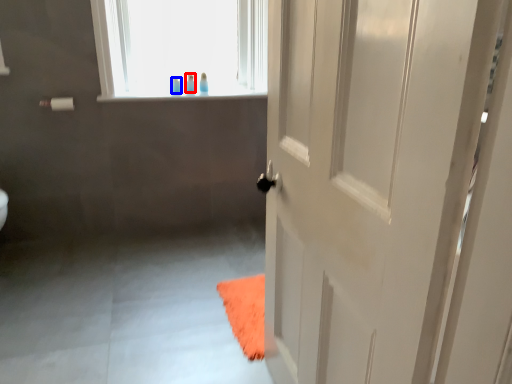
Question: Which object appears closest to the camera in this image, toiletry (highlighted by a red box) or toiletry (highlighted by a blue box)?

Choices:
 (A) toiletry
 (B) toiletry

Answer: (B)